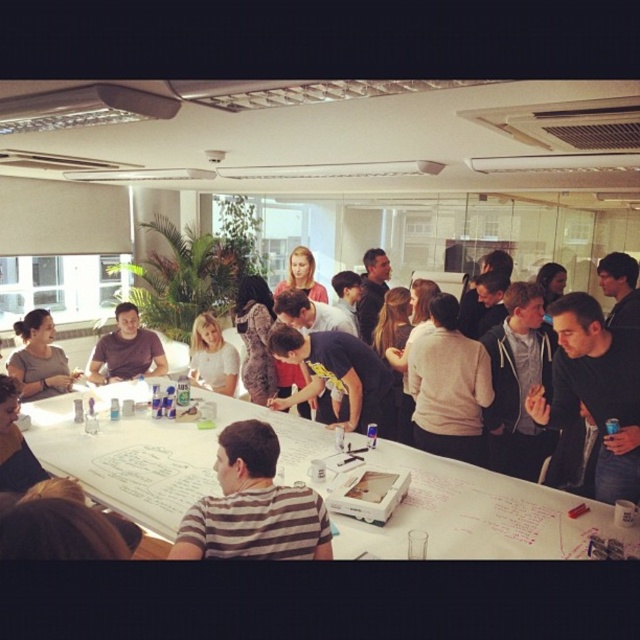
From the picture: You are organizing a meeting and need to place a 12 inch wide presentation binder on the table. The white paperboard at center and light brown hair at center are on the table. Which object has enough space to accommodate the binder without overlapping?

The white paperboard at center has a width larger than the light brown hair at center, so the presentation binder can be placed on the white paperboard at center without overlapping.